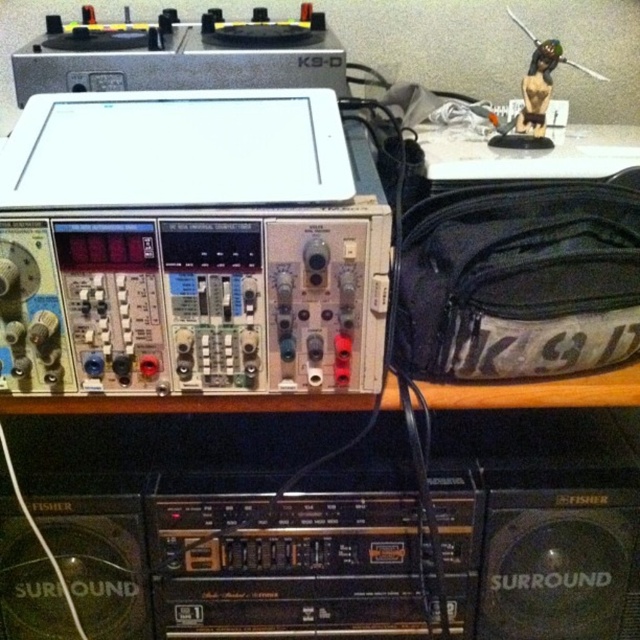
Which is below, black plastic speaker at lower right or matte black statue at upper right?

black plastic speaker at lower right is below.

Does point (636, 588) come closer to viewer compared to point (529, 116)?

That is False.

This screenshot has height=640, width=640. I want to click on black plastic speaker at lower right, so click(560, 554).

Consider the image. Which of these two, black plastic speaker at lower right or black plastic speaker at lower left, stands taller?

black plastic speaker at lower right

I want to click on black plastic speaker at lower right, so click(x=560, y=554).

Does point (552, 556) come behind point (61, 614)?

No, (552, 556) is closer to viewer.

Locate an element on the screen. black plastic speaker at lower right is located at coordinates (560, 554).

Is black plastic speaker at lower left shorter than matte black statue at upper right?

No.

Can you confirm if black plastic speaker at lower left is wider than matte black statue at upper right?

Correct, the width of black plastic speaker at lower left exceeds that of matte black statue at upper right.

Locate an element on the screen. This screenshot has width=640, height=640. black plastic speaker at lower left is located at coordinates (97, 550).